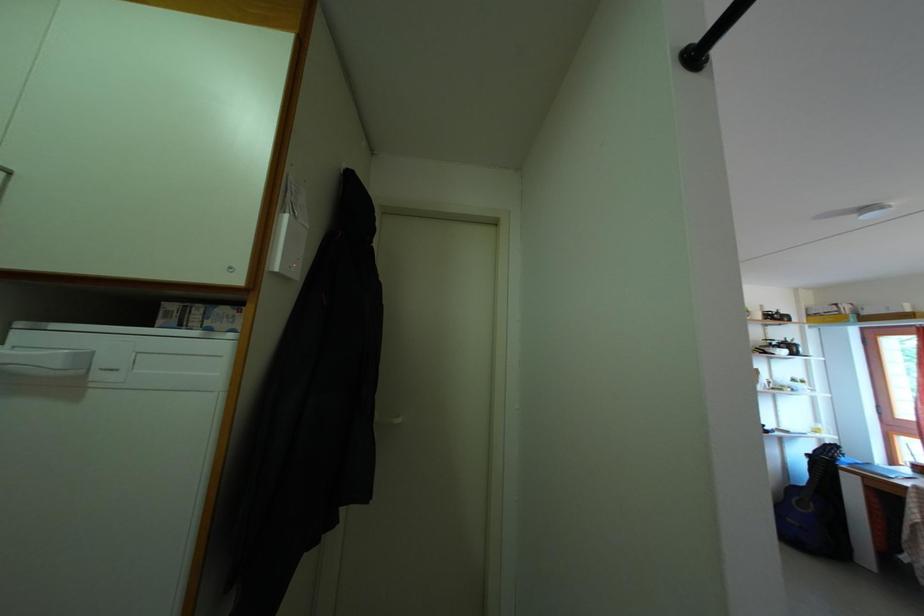
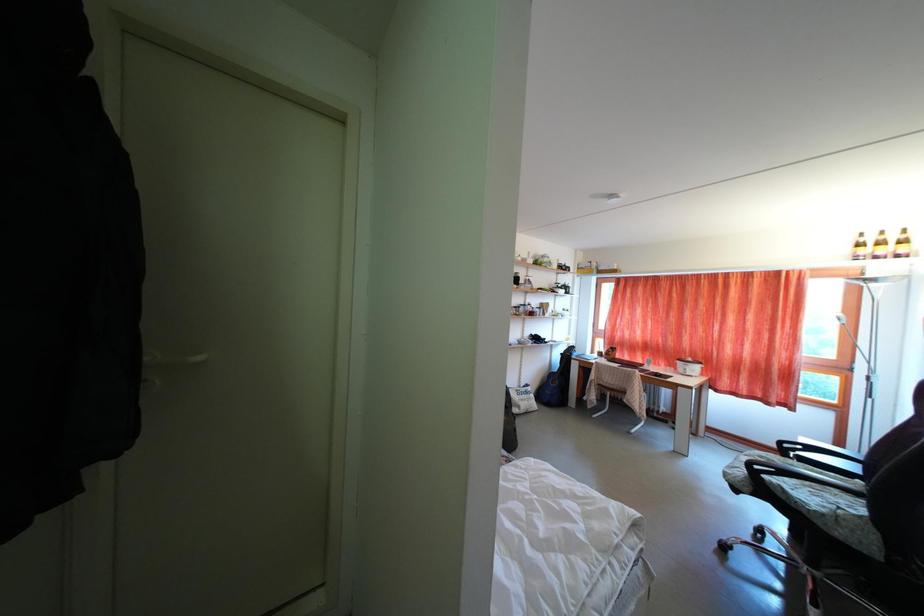
Question: The camera is either moving clockwise (left) or counter-clockwise (right) around the object. The first image is from the beginning of the video and the second image is from the end. Is the camera moving left or right when shooting the video?

Choices:
 (A) Left
 (B) Right

Answer: (A)